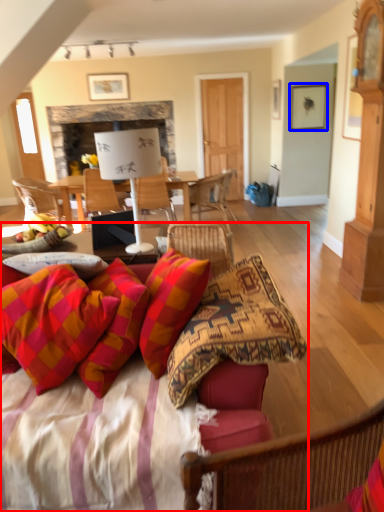
Question: Which object is closer to the camera taking this photo, studio couch (highlighted by a red box) or picture frame (highlighted by a blue box)?

Choices:
 (A) studio couch
 (B) picture frame

Answer: (A)